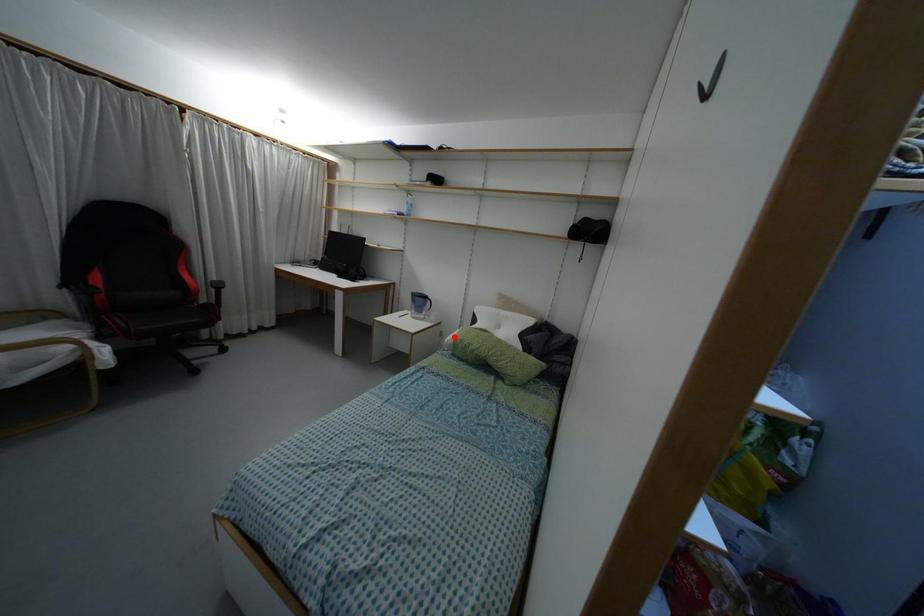
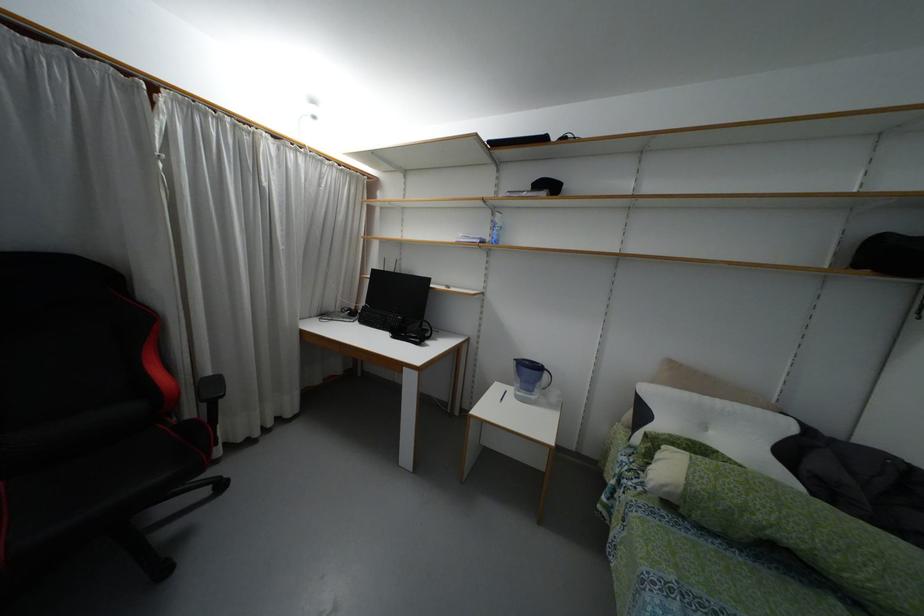
Locate, in the second image, the point that corresponds to the highlighted location in the first image.

(687, 483)